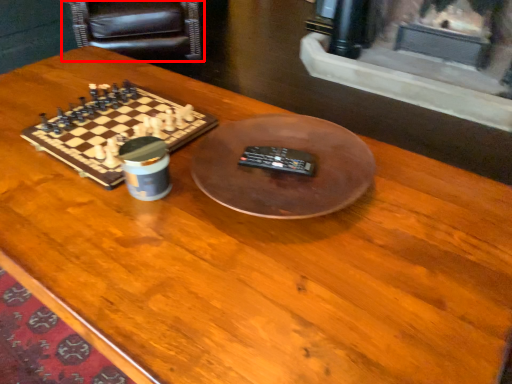
Question: From the image's perspective, where is armchair (annotated by the red box) located relative to board game?

Choices:
 (A) below
 (B) above

Answer: (B)